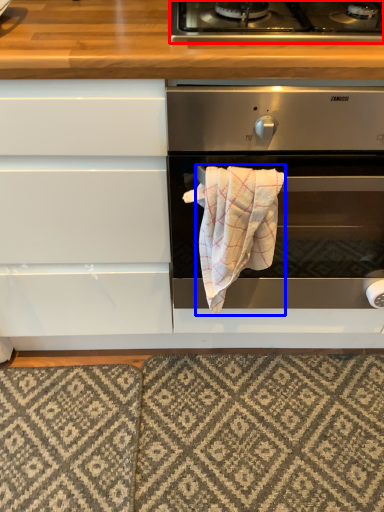
Question: Which object appears farthest to the camera in this image, gas stove (highlighted by a red box) or bath towel (highlighted by a blue box)?

Choices:
 (A) gas stove
 (B) bath towel

Answer: (B)